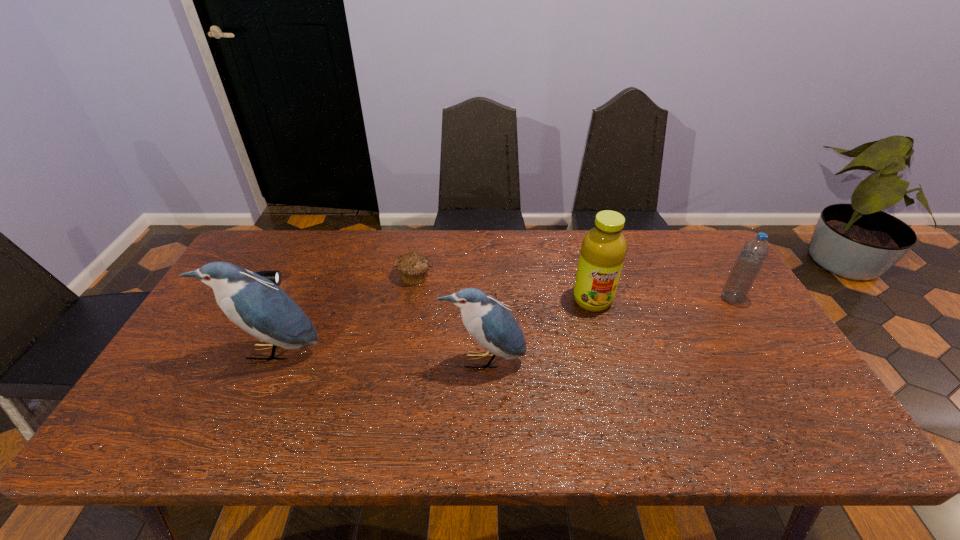
This screenshot has height=540, width=960. Find the location of `the left bird`. the left bird is located at coordinates (254, 303).

Locate an element on the screen. The width and height of the screenshot is (960, 540). the fourth object from left to right is located at coordinates (488, 321).

Where is `the right bird`? the right bird is located at coordinates (488, 321).

You are a GUI agent. You are given a task and a screenshot of the screen. Output one action in this format:
    pyautogui.click(x=<x>, y=<y>)
    Task: Click on the shortest object
    Image resolution: width=960 pixels, height=540 pixels.
    Given the screenshot: What is the action you would take?
    pyautogui.click(x=275, y=276)

Locate an element on the screen. The width and height of the screenshot is (960, 540). the rightmost object is located at coordinates (752, 256).

Locate an element on the screen. This screenshot has width=960, height=540. the second object from right to left is located at coordinates (603, 250).

Find the location of a particular element. The width and height of the screenshot is (960, 540). the second shortest object is located at coordinates 413,267.

Where is `the fourth object from right to left`? This screenshot has width=960, height=540. the fourth object from right to left is located at coordinates (413, 267).

I want to click on vacant space positioned at the tip of the left bird's beak, so click(253, 392).

This screenshot has height=540, width=960. I want to click on free region located 0.050m at the tip of the right bird's beak, so click(x=483, y=393).